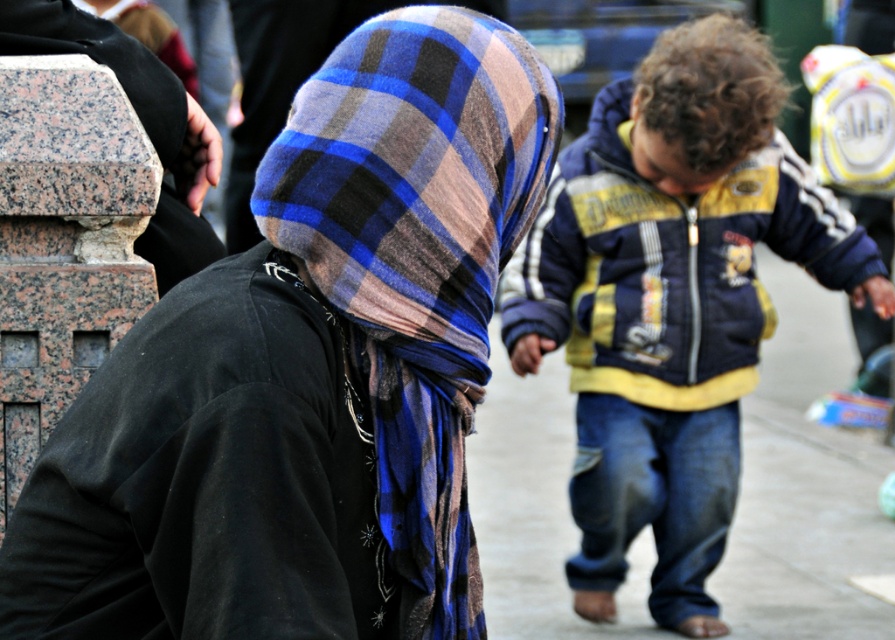
Can you confirm if blue and yellow jacket at center is bigger than plaid wool scarf at center?

Correct, blue and yellow jacket at center is larger in size than plaid wool scarf at center.

The image size is (895, 640). Describe the element at coordinates (671, 301) in the screenshot. I see `blue and yellow jacket at center` at that location.

Locate an element on the screen. blue and yellow jacket at center is located at coordinates (671, 301).